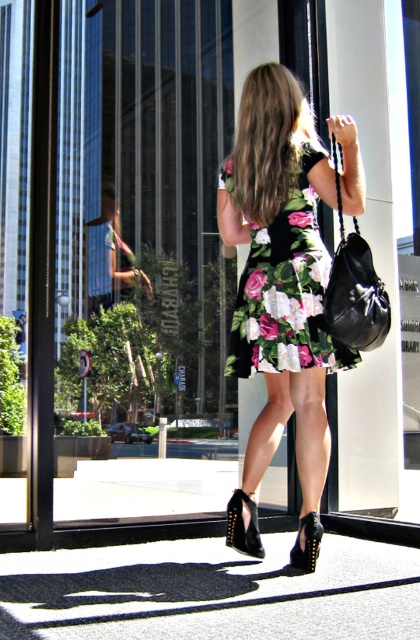
Looking at this image, who is lower down, floral dress at center or black leather handbag at right?

floral dress at center is below.

You are a GUI agent. You are given a task and a screenshot of the screen. Output one action in this format:
    pyautogui.click(x=<x>, y=<y>)
    Task: Click on the floral dress at center
    This screenshot has width=420, height=640.
    Given the screenshot: What is the action you would take?
    pyautogui.click(x=280, y=275)

Can you confirm if transparent glass door at center is wider than floral-patterned fabric dress at center?

Yes.

Which of these two, transparent glass door at center or floral-patterned fabric dress at center, stands shorter?

With less height is floral-patterned fabric dress at center.

Is point (123, 12) closer to viewer compared to point (281, 316)?

No, (123, 12) is further to viewer.

At what (x,y) coordinates should I click in order to perform the action: click on transparent glass door at center. Please return your answer as a coordinate pair (x, y). The image size is (420, 640). Looking at the image, I should click on (172, 189).

Does transparent glass door at center appear under black leather handbag at right?

Actually, transparent glass door at center is above black leather handbag at right.

Find the location of a particular element. The height and width of the screenshot is (640, 420). transparent glass door at center is located at coordinates (172, 189).

Where is `transparent glass door at center`? This screenshot has width=420, height=640. transparent glass door at center is located at coordinates (172, 189).